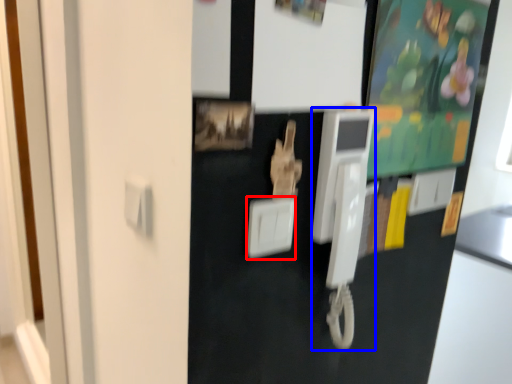
Question: Which object appears closest to the camera in this image, light switch (highlighted by a red box) or payphone (highlighted by a blue box)?

Choices:
 (A) light switch
 (B) payphone

Answer: (A)